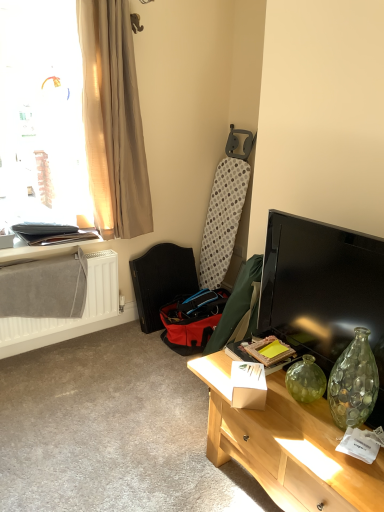
Question: Should I look upward or downward to see light wood desk at lower right?

Choices:
 (A) up
 (B) down

Answer: (B)

Question: Is matte black tv at right beside black leather swivel chair at lower left?

Choices:
 (A) no
 (B) yes

Answer: (A)

Question: From a real-world perspective, is matte black tv at right over black leather swivel chair at lower left?

Choices:
 (A) no
 (B) yes

Answer: (B)

Question: Considering the relative sizes of matte black tv at right and black leather swivel chair at lower left in the image provided, is matte black tv at right wider than black leather swivel chair at lower left?

Choices:
 (A) yes
 (B) no

Answer: (B)

Question: Can we say matte black tv at right lies outside black leather swivel chair at lower left?

Choices:
 (A) yes
 (B) no

Answer: (A)

Question: Is matte black tv at right bigger than black leather swivel chair at lower left?

Choices:
 (A) yes
 (B) no

Answer: (B)

Question: Is matte black tv at right to the right of black leather swivel chair at lower left from the viewer's perspective?

Choices:
 (A) yes
 (B) no

Answer: (A)

Question: Is beige sheer curtain at upper left aimed at translucent beige curtain at upper left?

Choices:
 (A) yes
 (B) no

Answer: (B)

Question: From a real-world perspective, does beige sheer curtain at upper left stand above translucent beige curtain at upper left?

Choices:
 (A) no
 (B) yes

Answer: (B)

Question: From a real-world perspective, is beige sheer curtain at upper left under translucent beige curtain at upper left?

Choices:
 (A) yes
 (B) no

Answer: (B)

Question: From the image's perspective, is beige sheer curtain at upper left beneath translucent beige curtain at upper left?

Choices:
 (A) yes
 (B) no

Answer: (A)

Question: Is beige sheer curtain at upper left not near translucent beige curtain at upper left?

Choices:
 (A) yes
 (B) no

Answer: (B)

Question: Is the position of beige sheer curtain at upper left more distant than that of translucent beige curtain at upper left?

Choices:
 (A) yes
 (B) no

Answer: (A)

Question: Is white textured radiator at left looking in the opposite direction of matte black laptop at left?

Choices:
 (A) yes
 (B) no

Answer: (B)